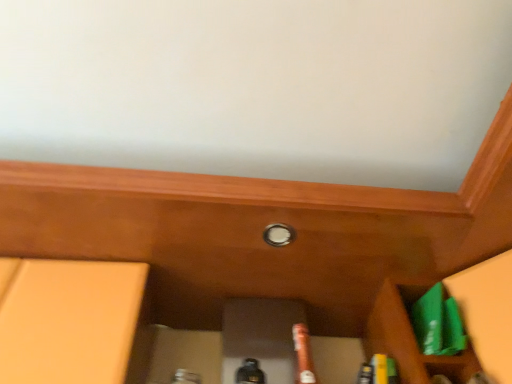
Question: In terms of height, does brown matte beer bottle at center look taller or shorter compared to green plastic bag at lower right?

Choices:
 (A) tall
 (B) short

Answer: (A)

Question: Is brown matte beer bottle at center to the left or to the right of green plastic bag at lower right in the image?

Choices:
 (A) left
 (B) right

Answer: (A)

Question: Which of these objects is positioned farthest from the green plastic bag at lower right?

Choices:
 (A) brown matte beer bottle at center
 (B) white glossy knob at center

Answer: (B)

Question: Which of these objects is positioned closest to the brown matte beer bottle at center?

Choices:
 (A) white glossy knob at center
 (B) green plastic bag at lower right

Answer: (B)